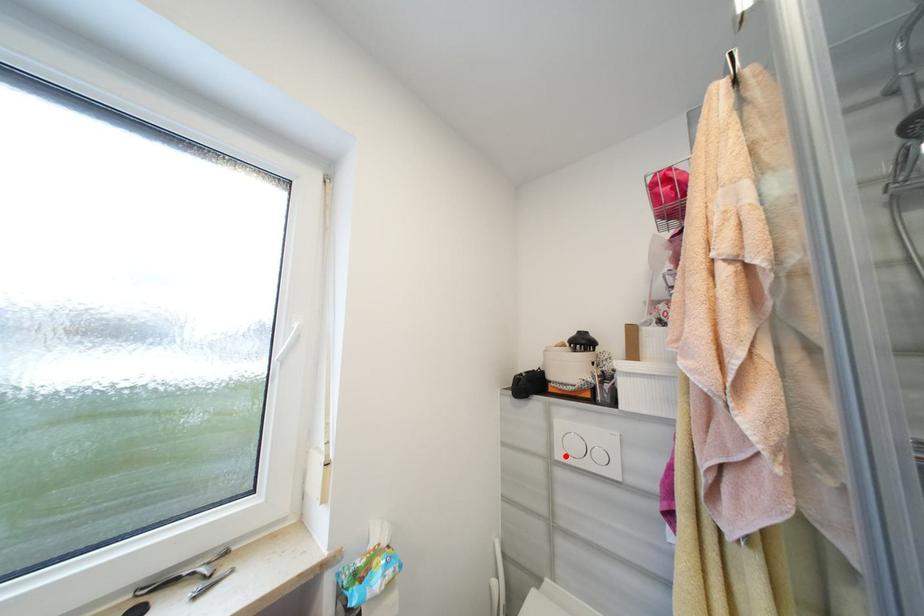
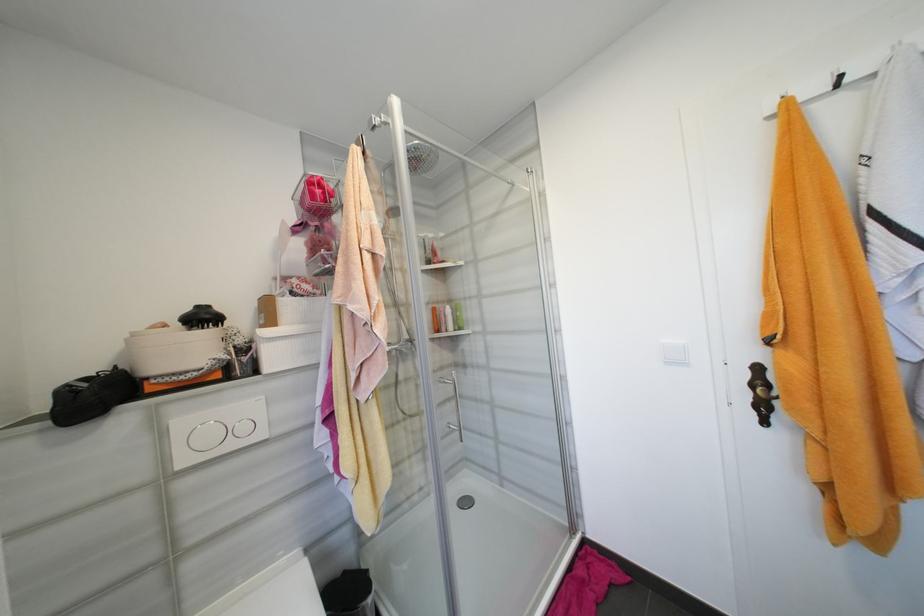
Find the pixel in the second image that matches the highlighted location in the first image.

(189, 463)